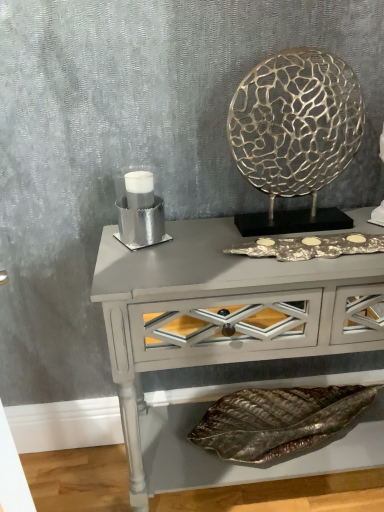
Locate an element on the screen. free space in front of silver metallic candle holder at left is located at coordinates (145, 268).